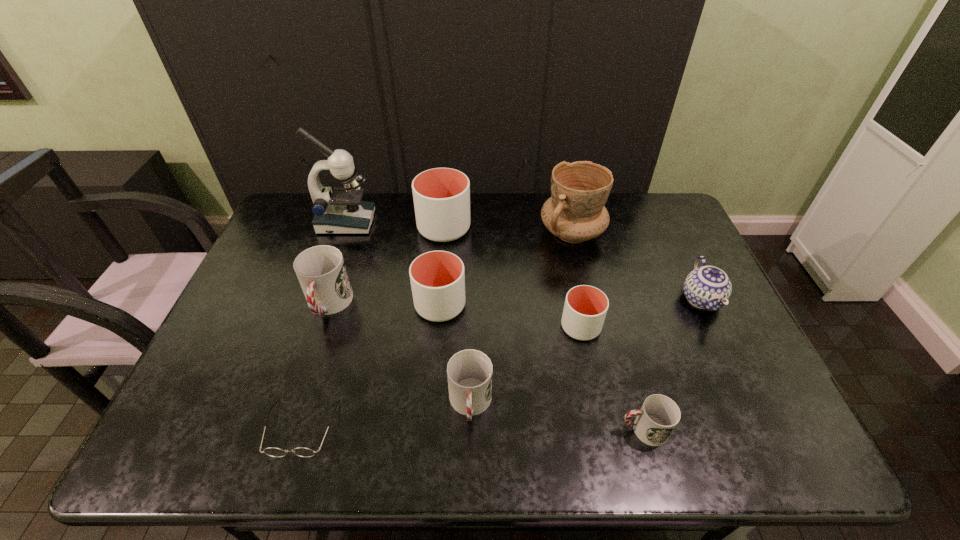
I want to click on vacant space located 0.220m on the front of the second smallest white cup, so click(432, 398).

Find the location of a particular element. The image size is (960, 540). blank area located at the spout of the blue chinaware is located at coordinates (763, 428).

You are a GUI agent. You are given a task and a screenshot of the screen. Output one action in this format:
    pyautogui.click(x=<x>, y=<y>)
    Task: Click on the vacant region located on the side of the second smallest red cup where the handle is located
    The height and width of the screenshot is (540, 960).
    Given the screenshot: What is the action you would take?
    pyautogui.click(x=469, y=461)

Where is `vacant space located on the right of the smallest white cup`? This screenshot has width=960, height=540. vacant space located on the right of the smallest white cup is located at coordinates (708, 327).

This screenshot has height=540, width=960. In order to click on vacant area located on the side of the second shortest object where the handle is located in this screenshot , I will do `click(512, 430)`.

You are a GUI agent. You are given a task and a screenshot of the screen. Output one action in this format:
    pyautogui.click(x=<x>, y=<y>)
    Task: Click on the vacant space situated on the side of the second shortest object where the handle is located
    
    Given the screenshot: What is the action you would take?
    pyautogui.click(x=588, y=430)

You are a GUI agent. You are given a task and a screenshot of the screen. Output one action in this format:
    pyautogui.click(x=<x>, y=<y>)
    Task: Click on the free space located 0.090m on the side of the second shortest object where the handle is located
    
    Given the screenshot: What is the action you would take?
    pyautogui.click(x=579, y=430)

Locate an element on the screen. The width and height of the screenshot is (960, 540). microscope that is at the far edge is located at coordinates (340, 211).

Image resolution: width=960 pixels, height=540 pixels. I want to click on pottery at the far edge, so click(x=575, y=212).

This screenshot has height=540, width=960. Find the location of `cup positioned at the far edge`. cup positioned at the far edge is located at coordinates (441, 196).